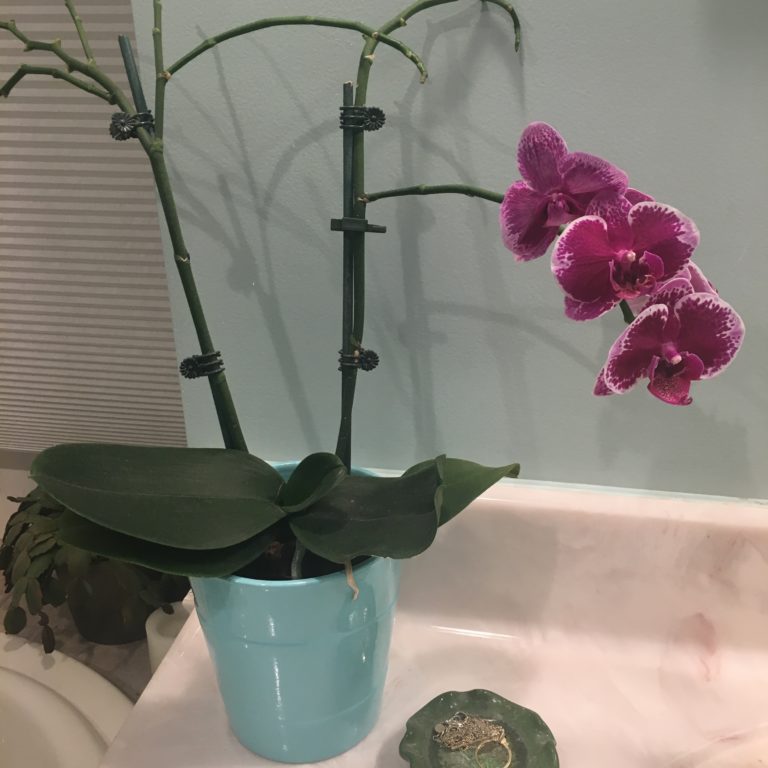
At what (x,y) coordinates should I click in order to perform the action: click on blinds. Please return your answer as a coordinate pair (x, y). Looking at the image, I should click on (68, 300).